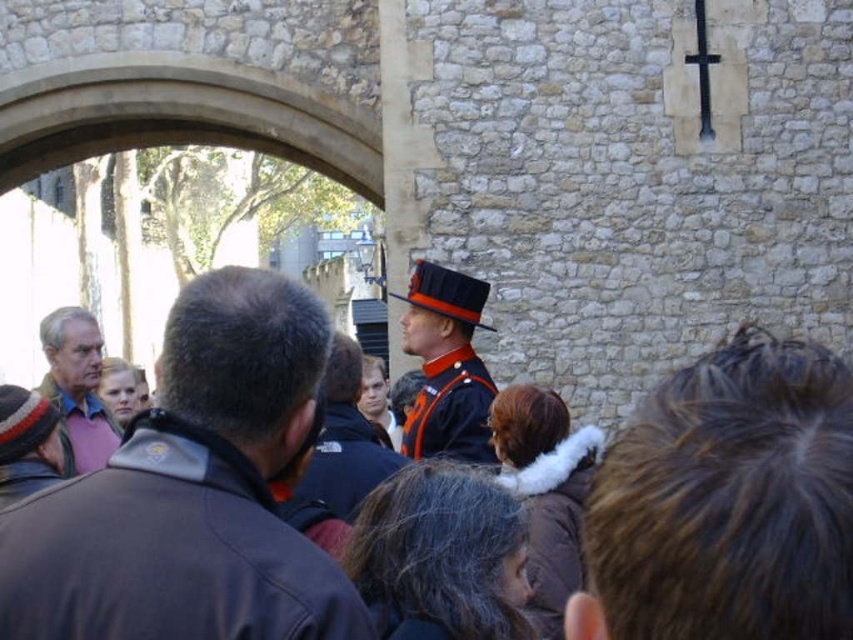
This screenshot has width=853, height=640. What are the coordinates of `orange fabric uniform at center` in the screenshot? It's located at (451, 410).

Is point (450, 413) closer to viewer compared to point (344, 451)?

No, (450, 413) is further to viewer.

Find the location of `orange fabric uniform at center`. orange fabric uniform at center is located at coordinates (451, 410).

Between point (815, 586) and point (335, 412), which one is positioned behind?

Positioned behind is point (335, 412).

Is dark brown leather jacket at center above shiny blue uniform at center?

Indeed, dark brown leather jacket at center is positioned over shiny blue uniform at center.

Between point (705, 477) and point (339, 417), which one is positioned behind?

Point (339, 417)

Locate an element on the screen. This screenshot has width=853, height=640. dark brown leather jacket at center is located at coordinates (190, 493).

Is point (271, 387) in front of point (194, 339)?

That is False.

Between dark brown leather jacket at center and orange uniform at center, which one appears on the right side from the viewer's perspective?

From the viewer's perspective, dark brown leather jacket at center appears more on the right side.

This screenshot has height=640, width=853. Identify the location of dark brown leather jacket at center. (190, 493).